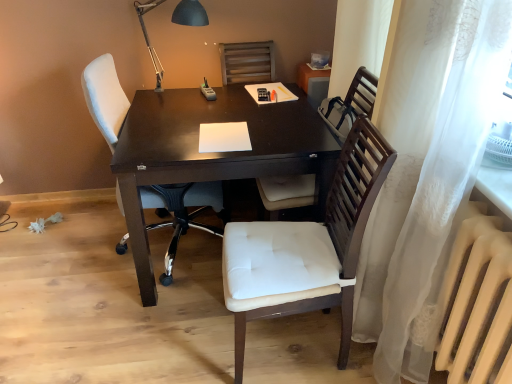
In order to face wooden chair at center, the 1th chair from the right, should I rotate leftwards or rightwards?

Turn right by 7.380 degrees to look at wooden chair at center, the 1th chair from the right.

In order to face white fabric chair at left, which is counted as the first chair, starting from the left, should I rotate leftwards or rightwards?

A 11.640 degree turn to the left will do.

This screenshot has height=384, width=512. What do you see at coordinates (224, 137) in the screenshot?
I see `white paper at center` at bounding box center [224, 137].

This screenshot has height=384, width=512. What do you see at coordinates (190, 14) in the screenshot? I see `black metal table lamp at upper center` at bounding box center [190, 14].

You are a GUI agent. You are given a task and a screenshot of the screen. Output one action in this format:
    pyautogui.click(x=<x>, y=<y>)
    Task: Click on the white matte radiator at lower right
    The width and height of the screenshot is (512, 384).
    Given the screenshot: What is the action you would take?
    pyautogui.click(x=477, y=305)

Locate an element on the screen. This screenshot has height=384, width=512. desk in front of the white paper at center is located at coordinates (214, 153).

Is dark wood desk at center located within white paper at center?

No, dark wood desk at center is not surrounded by white paper at center.

In the scene shown: From a real-world perspective, which is physically above, white paper at center or dark wood desk at center?

In real-world perspective, white paper at center is above.

In terms of width, does white paper at center look wider or thinner when compared to dark wood desk at center?

Considering their sizes, white paper at center looks slimmer than dark wood desk at center.

From the image's perspective, which one is positioned higher, wooden chair at center, the 1th chair from the right, or black metal table lamp at upper center?

black metal table lamp at upper center is shown above in the image.

Is wooden chair at center, the 3th chair viewed from the left, wider than black metal table lamp at upper center?

Yes, wooden chair at center, the 3th chair viewed from the left, is wider than black metal table lamp at upper center.

Is wooden chair at center, the 3th chair viewed from the left, in contact with black metal table lamp at upper center?

No, wooden chair at center, the 3th chair viewed from the left, is not in contact with black metal table lamp at upper center.

Does point (361, 108) appear closer or farther from the camera than point (193, 4)?

Point (361, 108).

Considering the relative sizes of white fabric chair at left, which is the third chair from right to left, and white matte radiator at lower right in the image provided, is white fabric chair at left, which is the third chair from right to left, thinner than white matte radiator at lower right?

Incorrect, the width of white fabric chair at left, which is the third chair from right to left, is not less than that of white matte radiator at lower right.

Relative to white matte radiator at lower right, is white fabric chair at left, which is the third chair from right to left, in front or behind?

white fabric chair at left, which is the third chair from right to left, is behind white matte radiator at lower right.

Considering the positions of point (361, 124) and point (194, 200), is point (361, 124) closer or farther from the camera than point (194, 200)?

Point (361, 124) is positioned closer to the camera compared to point (194, 200).

Which of these two, white fabric chair at center, which is the second chair from right to left, or white fabric chair at left, which is counted as the first chair, starting from the left, is smaller?

white fabric chair at center, which is the second chair from right to left, is smaller.

Based on the photo, is white fabric chair at center, which is the second chair in left-to-right order, in contact with white fabric chair at left, which is counted as the first chair, starting from the left?

No, white fabric chair at center, which is the second chair in left-to-right order, is not next to white fabric chair at left, which is counted as the first chair, starting from the left.

From the image's perspective, between white fabric chair at center, which is the second chair in left-to-right order, and dark wood desk at center, who is located below?

white fabric chair at center, which is the second chair in left-to-right order, appears lower in the image.

From a real-world perspective, is white fabric chair at center, which is the second chair from right to left, physically below dark wood desk at center?

No, from a real-world perspective, white fabric chair at center, which is the second chair from right to left, is not under dark wood desk at center.

Considering the points (280, 310) and (139, 91), which point is in front, point (280, 310) or point (139, 91)?

The point (280, 310) is in front.

Is white fabric chair at center, which is the second chair in left-to-right order, turned away from dark wood desk at center?

No, dark wood desk at center is not at the back of white fabric chair at center, which is the second chair in left-to-right order.

Can you tell me how much white matte radiator at lower right and dark wood desk at center differ in facing direction?

white matte radiator at lower right and dark wood desk at center are facing 91.3 degrees away from each other.

Considering the sizes of white matte radiator at lower right and dark wood desk at center in the image, is white matte radiator at lower right wider or thinner than dark wood desk at center?

white matte radiator at lower right is thinner than dark wood desk at center.

From the image's perspective, relative to dark wood desk at center, is white matte radiator at lower right above or below?

From the image's perspective, white matte radiator at lower right appears below dark wood desk at center.

Is white matte radiator at lower right not within dark wood desk at center?

Yes.

Considering the relative positions of white sheer curtain at right and white matte radiator at lower right in the image provided, is white sheer curtain at right in front of white matte radiator at lower right?

Yes, white sheer curtain at right is closer to the viewer.

Who is bigger, white sheer curtain at right or white matte radiator at lower right?

Bigger between the two is white sheer curtain at right.

From the picture: Does white sheer curtain at right appear on the right side of white matte radiator at lower right?

A: No, white sheer curtain at right is not to the right of white matte radiator at lower right.

Based on the photo, from the image's perspective, which one is positioned lower, white sheer curtain at right or white matte radiator at lower right?

white matte radiator at lower right.

The width and height of the screenshot is (512, 384). In the image, there is a white paper at center. What are the coordinates of `desk below it (from the image's perspective)` in the screenshot? It's located at (214, 153).

Locate an element on the screen. Image resolution: width=512 pixels, height=384 pixels. the 1st chair in front of the black metal table lamp at upper center, counting from the anchor's position is located at coordinates (351, 104).

Looking at the image, which one is located closer to white matte radiator at lower right, white sheer curtain at right or white fabric chair at center, which is the second chair from right to left?

white sheer curtain at right is positioned closer to the anchor white matte radiator at lower right.

Based on their spatial positions, is wooden chair at center, the 1th chair from the right, or white paper at center further from white fabric chair at left, which is counted as the first chair, starting from the left?

wooden chair at center, the 1th chair from the right.

Estimate the real-world distances between objects in this image. Which object is closer to white matte radiator at lower right, black metal table lamp at upper center or dark wood desk at center?

The object closer to white matte radiator at lower right is dark wood desk at center.

Considering their positions, is dark wood desk at center positioned further to white fabric chair at left, which is the third chair from right to left, than black metal table lamp at upper center?

Among the two, black metal table lamp at upper center is located further to white fabric chair at left, which is the third chair from right to left.

Estimate the real-world distances between objects in this image. Which object is further from white fabric chair at center, which is the second chair in left-to-right order, white paper at center or wooden chair at center, the 1th chair from the right?

Based on the image, white paper at center appears to be further to white fabric chair at center, which is the second chair in left-to-right order.

Which object lies further to the anchor point white paper at center, white matte radiator at lower right or black metal table lamp at upper center?

Among the two, white matte radiator at lower right is located further to white paper at center.

In the scene shown: Estimate the real-world distances between objects in this image. Which object is closer to white fabric chair at left, which is the third chair from right to left, dark wood desk at center or white paper at center?

dark wood desk at center is positioned closer to the anchor white fabric chair at left, which is the third chair from right to left.

When comparing their distances from white fabric chair at center, which is the second chair in left-to-right order, does dark wood desk at center or white fabric chair at left, which is counted as the first chair, starting from the left, seem closer?

dark wood desk at center.

Locate an element on the screen. desk between white fabric chair at left, which is the third chair from right to left, and white matte radiator at lower right from left to right is located at coordinates (214, 153).

This screenshot has width=512, height=384. Identify the location of notepad between dark wood desk at center and white matte radiator at lower right. (224, 137).

Where is `desk between black metal table lamp at upper center and white fabric chair at center, which is the second chair in left-to-right order, vertically`? The image size is (512, 384). desk between black metal table lamp at upper center and white fabric chair at center, which is the second chair in left-to-right order, vertically is located at coordinates (214, 153).

At what (x,y) coordinates should I click in order to perform the action: click on desk between white fabric chair at left, which is counted as the first chair, starting from the left, and white sheer curtain at right from left to right. Please return your answer as a coordinate pair (x, y). This screenshot has width=512, height=384. Looking at the image, I should click on (214, 153).